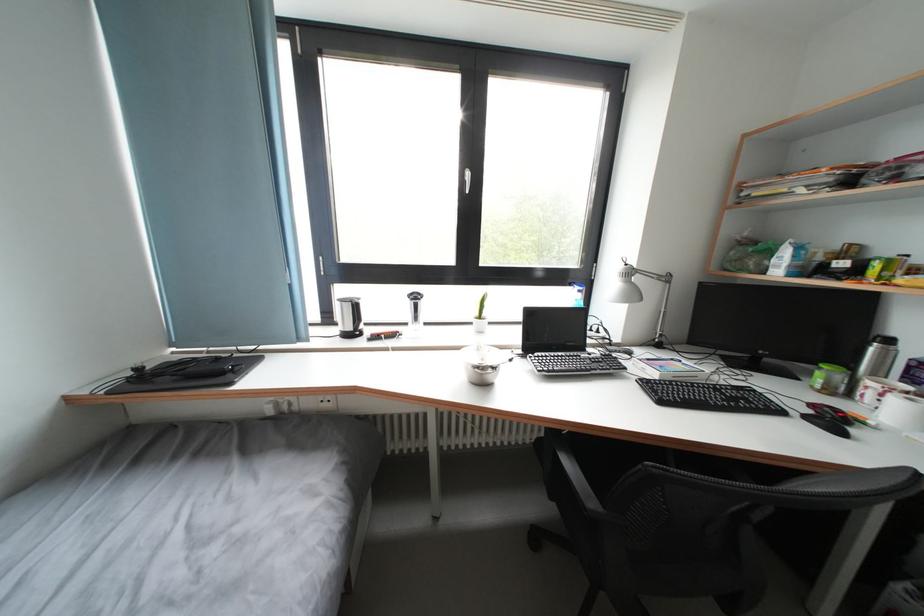
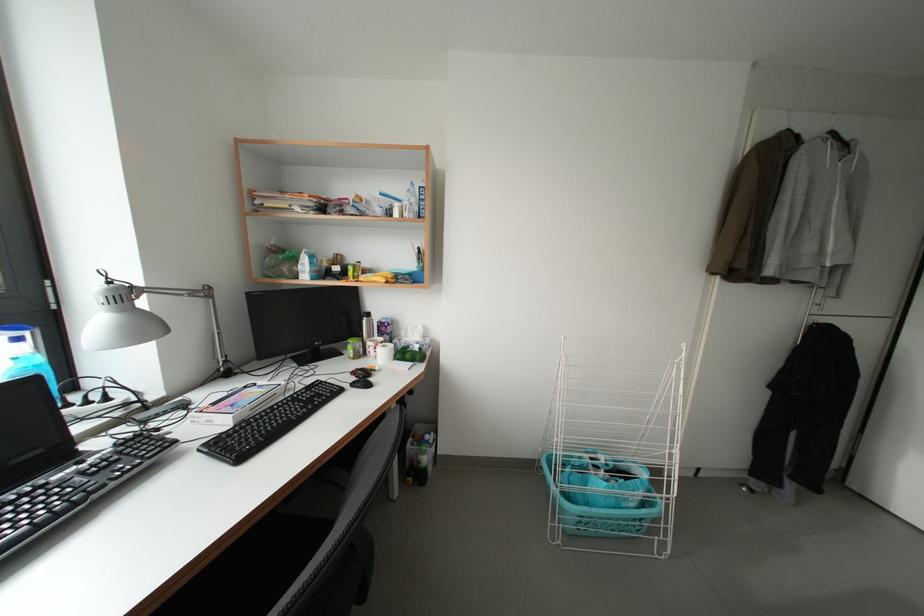
Question: Based on the continuous images, in which direction is the camera rotating? Reply with the corresponding letter.

Choices:
 (A) Left
 (B) Right
 (C) Up
 (D) Down

Answer: (B)